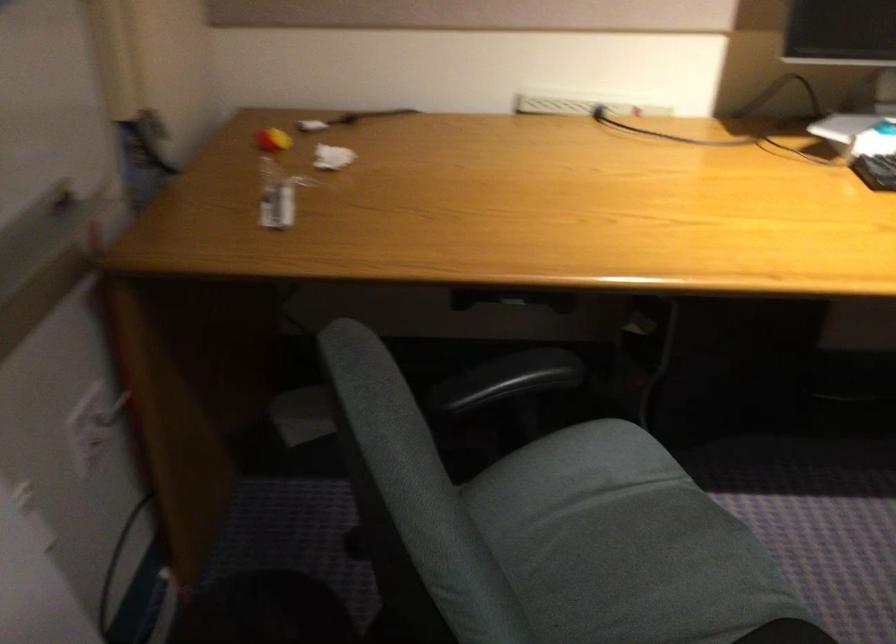
The height and width of the screenshot is (644, 896). Find the location of `chair sitting surface`. chair sitting surface is located at coordinates (622, 544).